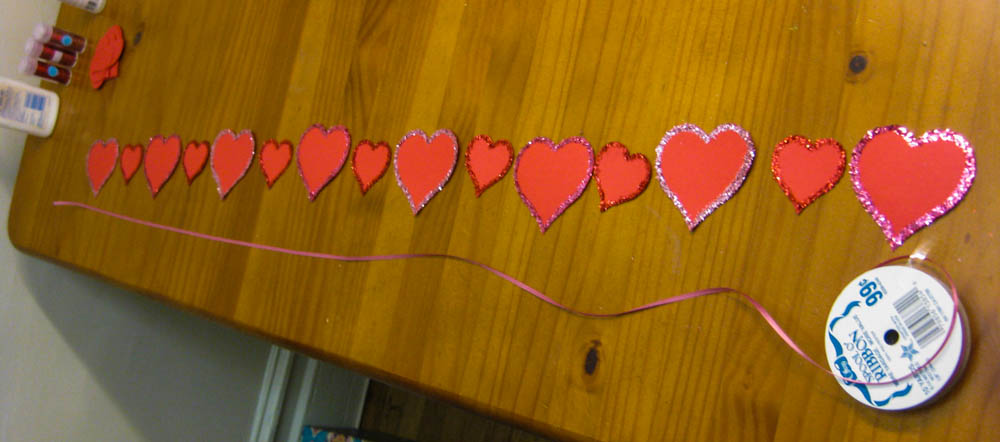
You are a GUI agent. You are given a task and a screenshot of the screen. Output one action in this format:
    pyautogui.click(x=<x>, y=<y>)
    Task: Click on the wall
    Image resolution: width=1000 pixels, height=442 pixels.
    Given the screenshot: What is the action you would take?
    pyautogui.click(x=123, y=378), pyautogui.click(x=72, y=326)